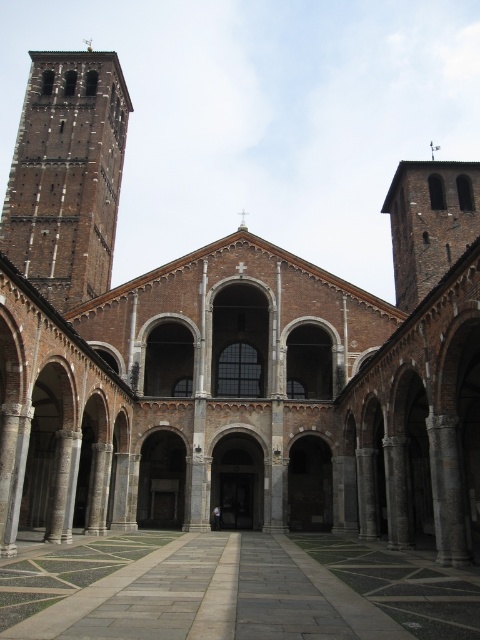
Is smooth stone floor at center to the left of brick tower at upper left from the viewer's perspective?

In fact, smooth stone floor at center is to the right of brick tower at upper left.

Who is higher up, smooth stone floor at center or brick tower at upper left?

brick tower at upper left

Is point (183, 627) positioned before point (96, 74)?

Yes, point (183, 627) is closer to viewer.

This screenshot has width=480, height=640. In order to click on smooth stone floor at center in this screenshot , I will do `click(232, 589)`.